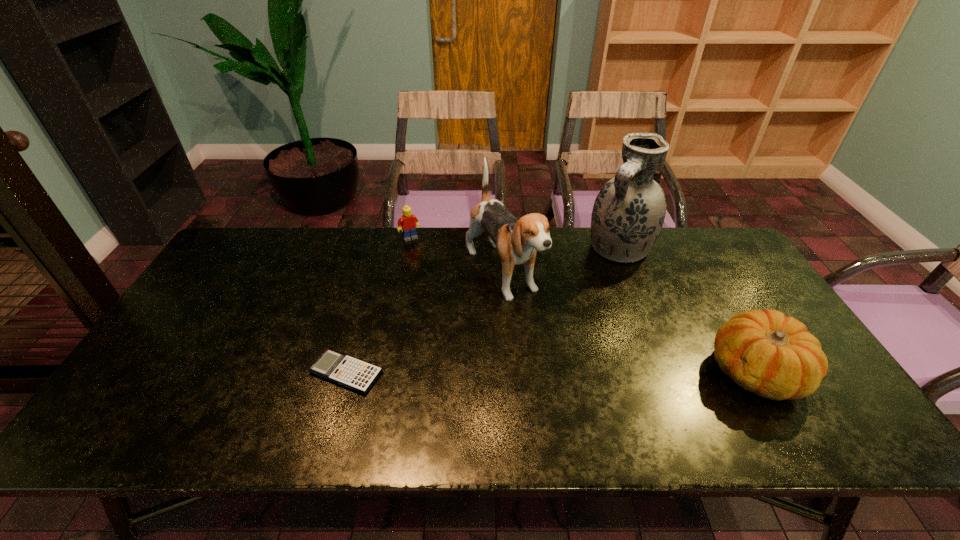
Where is `vacant space in between the gourd and the Lego`? This screenshot has width=960, height=540. vacant space in between the gourd and the Lego is located at coordinates (583, 305).

Image resolution: width=960 pixels, height=540 pixels. What are the coordinates of `empty space between the second tallest object and the calculator` in the screenshot? It's located at (424, 324).

The height and width of the screenshot is (540, 960). Identify the location of unoccupied position between the puppy and the calculator. (x=424, y=324).

At what (x,y) coordinates should I click in order to perform the action: click on free space between the puppy and the calculator. Please return your answer as a coordinate pair (x, y). The width and height of the screenshot is (960, 540). Looking at the image, I should click on (424, 324).

In order to click on free space that is in between the Lego and the shortest object in this screenshot , I will do `click(378, 305)`.

What are the coordinates of `vacant space that's between the vase and the puppy` in the screenshot? It's located at (561, 261).

Find the location of a particular element. Image resolution: width=960 pixels, height=540 pixels. free space between the gourd and the vase is located at coordinates (687, 309).

Locate an element on the screen. The image size is (960, 540). object that is the fourth nearest to the vase is located at coordinates (347, 371).

The width and height of the screenshot is (960, 540). In order to click on object that is the fourth nearest to the fourth shortest object in this screenshot , I will do `click(765, 352)`.

This screenshot has width=960, height=540. Find the location of `vacant space that satisfies the following two spatial constraints: 1. on the front side of the Lego; 2. on the left side of the fourth shortest object`. vacant space that satisfies the following two spatial constraints: 1. on the front side of the Lego; 2. on the left side of the fourth shortest object is located at coordinates (403, 275).